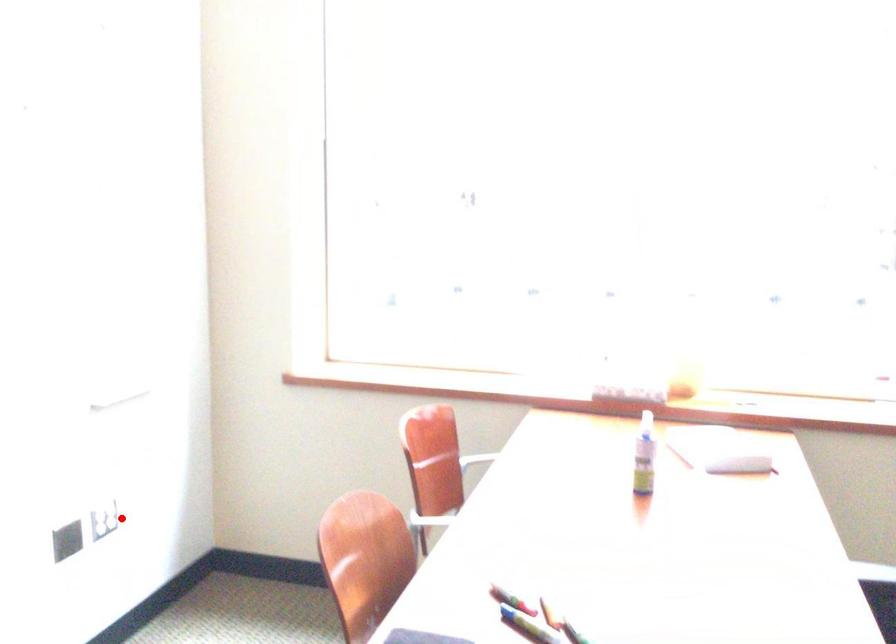
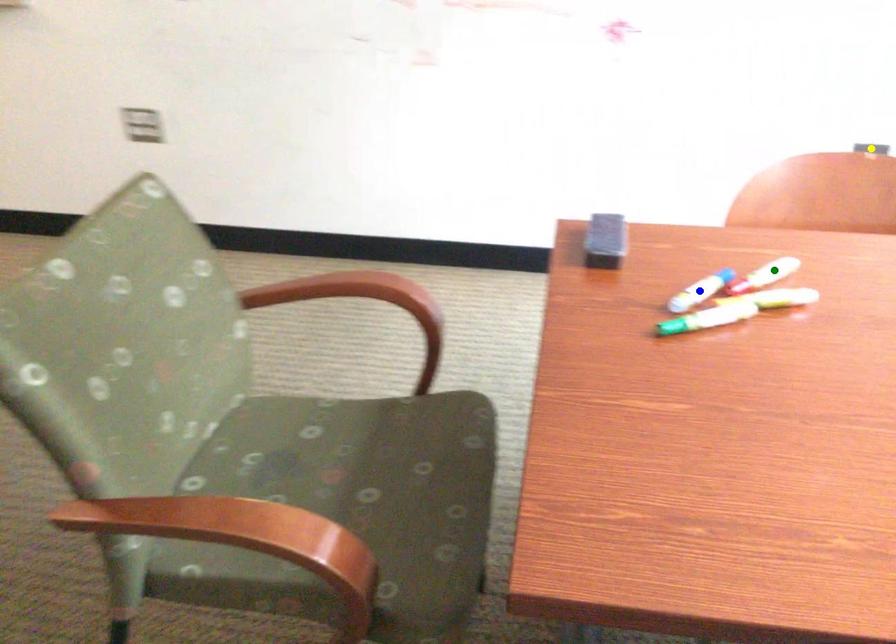
Question: I am providing you with two images of the same scene from different viewpoints. A red point is marked on the first image. You are given multiple points on the second image. Which spot in image 2 lines up with the point in image 1?

Choices:
 (A) yellow point
 (B) blue point
 (C) green point

Answer: (A)